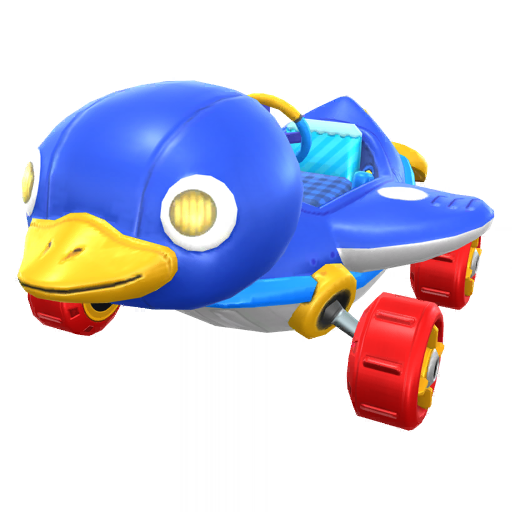
You are a GUI agent. You are given a task and a screenshot of the screen. Output one action in this format:
    pyautogui.click(x=<x>, y=<y>)
    Task: Click on the toy
    This screenshot has height=512, width=512.
    Given the screenshot: What is the action you would take?
    pyautogui.click(x=222, y=274)